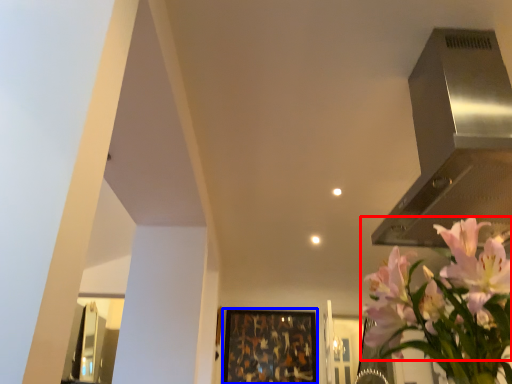
Question: Among these objects, which one is nearest to the camera, flower (highlighted by a red box) or picture frame (highlighted by a blue box)?

Choices:
 (A) flower
 (B) picture frame

Answer: (A)